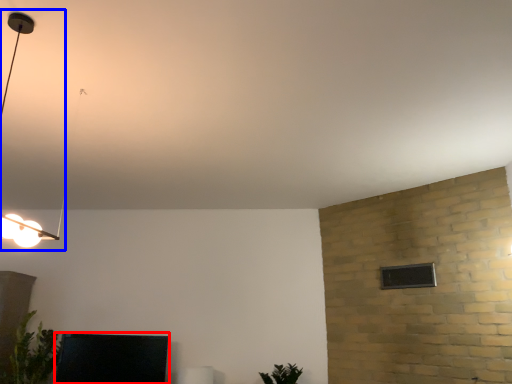
Question: Among these objects, which one is nearest to the camera, furniture (highlighted by a red box) or lamp (highlighted by a blue box)?

Choices:
 (A) furniture
 (B) lamp

Answer: (B)